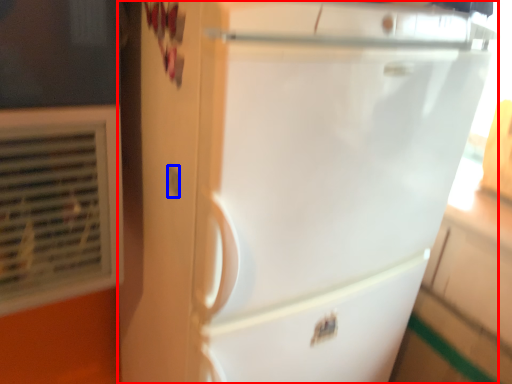
Question: Which point is further to the camera, refrigerator (highlighted by a red box) or electric outlet (highlighted by a blue box)?

Choices:
 (A) refrigerator
 (B) electric outlet

Answer: (B)